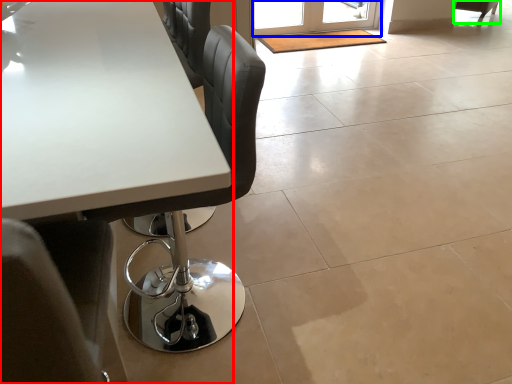
Question: Which is farther away from table (highlighted by a red box)? screen door (highlighted by a blue box) or chair (highlighted by a green box)?

Choices:
 (A) screen door
 (B) chair

Answer: (B)